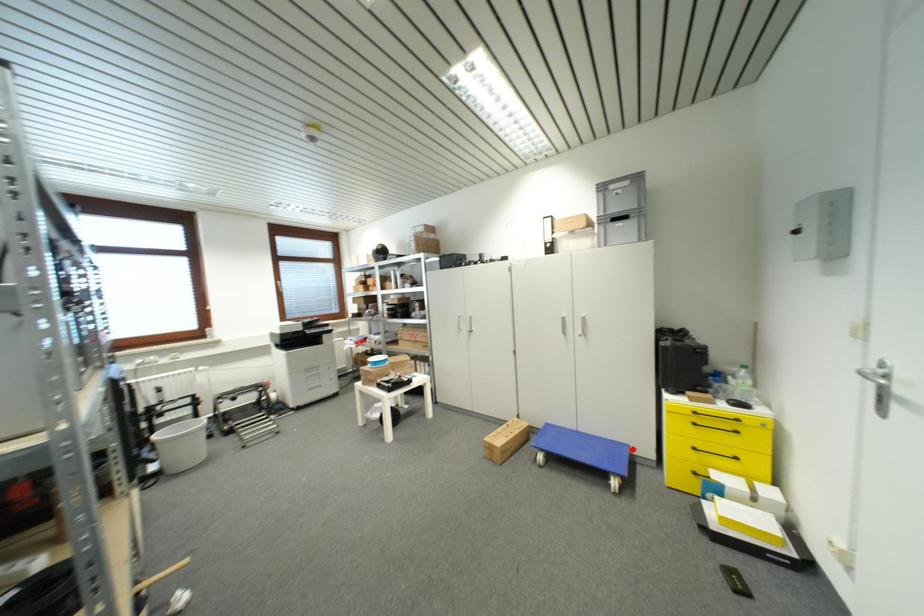
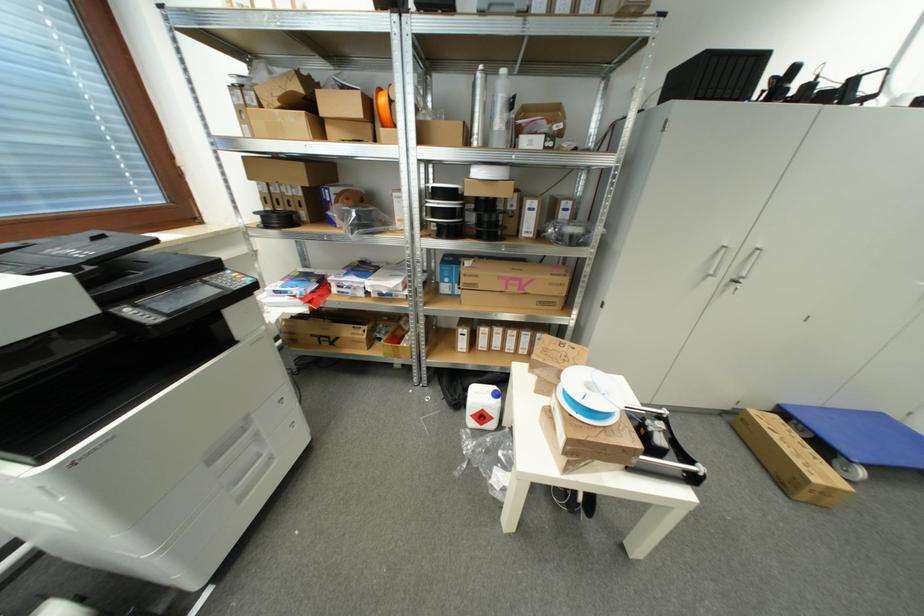
In the second image, find the point that corresponds to the highlighted location in the first image.

(885, 418)